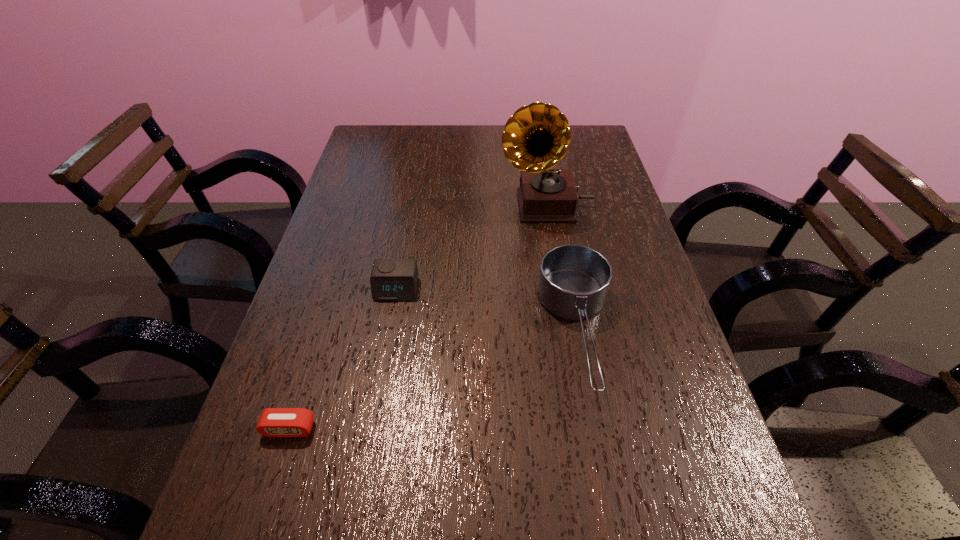
The image size is (960, 540). What are the coordinates of `free location that satisfies the following two spatial constraints: 1. from the horn of the farthest object; 2. on the front-facing side of the second shortest object` in the screenshot? It's located at (561, 289).

This screenshot has width=960, height=540. Find the location of `vacant region that satisfies the following two spatial constraints: 1. from the horn of the farthest object; 2. on the front-facing side of the shortest object`. vacant region that satisfies the following two spatial constraints: 1. from the horn of the farthest object; 2. on the front-facing side of the shortest object is located at coordinates (584, 429).

Locate an element on the screen. This screenshot has height=540, width=960. free space in the image that satisfies the following two spatial constraints: 1. from the horn of the phonograph record; 2. on the front-facing side of the leftmost object is located at coordinates (584, 429).

You are a GUI agent. You are given a task and a screenshot of the screen. Output one action in this format:
    pyautogui.click(x=<x>, y=<y>)
    Task: Click on the free location that satisfies the following two spatial constraints: 1. from the horn of the farthest object; 2. on the front-facing side of the leftmost object
    The width and height of the screenshot is (960, 540).
    Given the screenshot: What is the action you would take?
    pyautogui.click(x=584, y=429)

This screenshot has height=540, width=960. Identify the location of free space that satisfies the following two spatial constraints: 1. from the horn of the farthest object; 2. on the front-facing side of the shortest object. (584, 429).